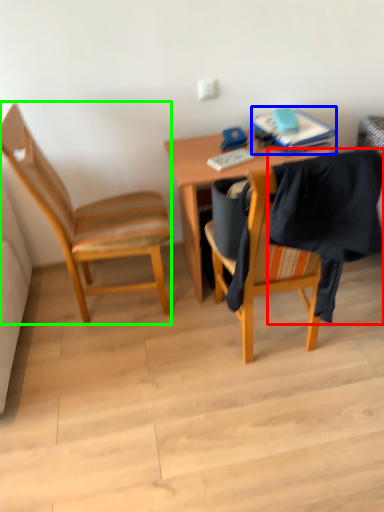
Question: Which is farther away from clothe (highlighted by a red box)? book (highlighted by a blue box) or chair (highlighted by a green box)?

Choices:
 (A) book
 (B) chair

Answer: (B)